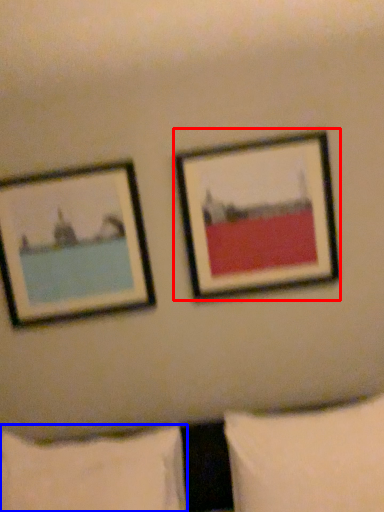
Question: Which of the following is the farthest to the observer, picture frame (highlighted by a red box) or pillow (highlighted by a blue box)?

Choices:
 (A) picture frame
 (B) pillow

Answer: (A)